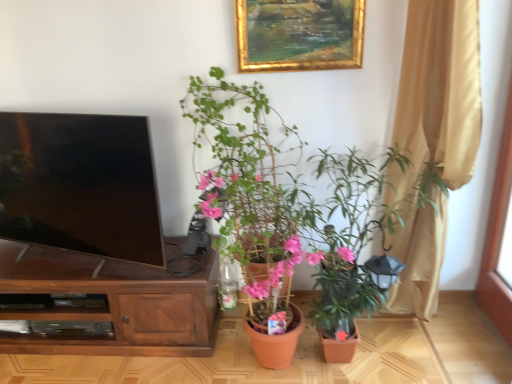
Question: Can you confirm if matte terracotta pot at center, acting as the first houseplant starting from the left, is bigger than green matte plant at lower right, marked as the 1th houseplant in a right-to-left arrangement?

Choices:
 (A) yes
 (B) no

Answer: (B)

Question: Does matte terracotta pot at center, acting as the first houseplant starting from the left, have a smaller size compared to green matte plant at lower right, marked as the 1th houseplant in a right-to-left arrangement?

Choices:
 (A) no
 (B) yes

Answer: (B)

Question: Would you say green matte plant at lower right, marked as the 1th houseplant in a right-to-left arrangement, is part of matte terracotta pot at center, acting as the first houseplant starting from the left,'s contents?

Choices:
 (A) yes
 (B) no

Answer: (B)

Question: Is matte terracotta pot at center, marked as the 2th houseplant in a right-to-left arrangement, aimed at green matte plant at lower right, marked as the 1th houseplant in a right-to-left arrangement?

Choices:
 (A) no
 (B) yes

Answer: (A)

Question: Would you say matte terracotta pot at center, marked as the 2th houseplant in a right-to-left arrangement, is outside green matte plant at lower right, marked as the 1th houseplant in a right-to-left arrangement?

Choices:
 (A) no
 (B) yes

Answer: (A)

Question: Does matte terracotta pot at center, acting as the first houseplant starting from the left, touch green matte plant at lower right, acting as the second houseplant starting from the left?

Choices:
 (A) yes
 (B) no

Answer: (A)

Question: Considering the relative positions of matte black tv at left and beige fabric curtain at right in the image provided, is matte black tv at left to the right of beige fabric curtain at right from the viewer's perspective?

Choices:
 (A) yes
 (B) no

Answer: (B)

Question: From the image's perspective, is matte black tv at left located beneath beige fabric curtain at right?

Choices:
 (A) no
 (B) yes

Answer: (B)

Question: Considering the relative sizes of matte black tv at left and beige fabric curtain at right in the image provided, is matte black tv at left wider than beige fabric curtain at right?

Choices:
 (A) no
 (B) yes

Answer: (A)

Question: Would you consider matte black tv at left to be distant from beige fabric curtain at right?

Choices:
 (A) yes
 (B) no

Answer: (A)

Question: From the image's perspective, is matte black tv at left located above beige fabric curtain at right?

Choices:
 (A) yes
 (B) no

Answer: (B)

Question: Is matte black tv at left thinner than beige fabric curtain at right?

Choices:
 (A) no
 (B) yes

Answer: (B)

Question: Does matte terracotta pot at center, marked as the 2th houseplant in a right-to-left arrangement, have a greater height compared to beige fabric curtain at right?

Choices:
 (A) yes
 (B) no

Answer: (B)